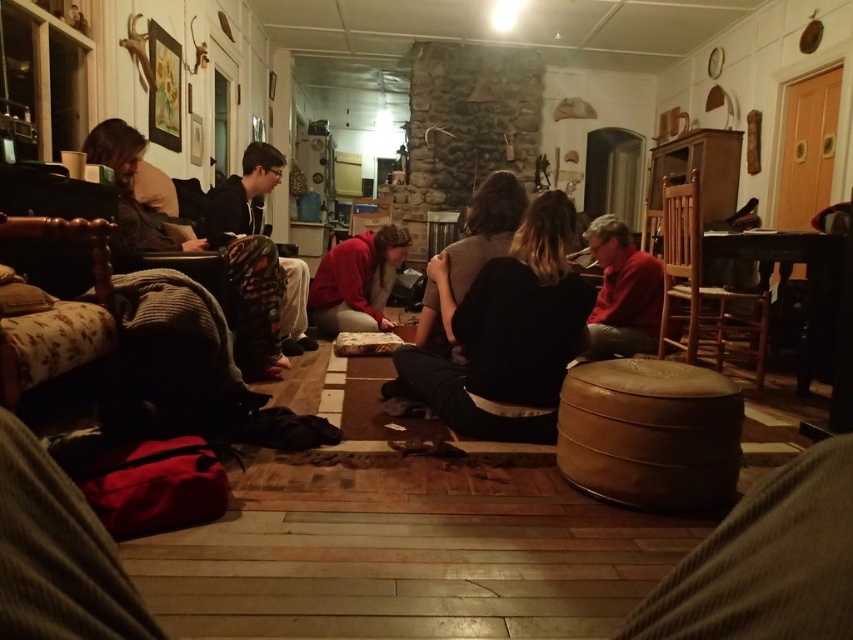
In the scene shown: Does leather ottoman at center appear over black hoodie at center?

Actually, leather ottoman at center is below black hoodie at center.

Between leather ottoman at center and black hoodie at center, which one is positioned lower?

leather ottoman at center

Locate an element on the screen. The width and height of the screenshot is (853, 640). leather ottoman at center is located at coordinates (650, 433).

Find the location of `leather ottoman at center`. leather ottoman at center is located at coordinates (650, 433).

Which of these two, leather ottoman at center or black fabric at center, stands shorter?

With less height is leather ottoman at center.

Between point (619, 420) and point (518, 198), which one is positioned behind?

Positioned behind is point (518, 198).

You are a GUI agent. You are given a task and a screenshot of the screen. Output one action in this format:
    pyautogui.click(x=<x>, y=<y>)
    Task: Click on the leather ottoman at center
    This screenshot has width=853, height=640.
    Given the screenshot: What is the action you would take?
    pyautogui.click(x=650, y=433)

Does leather ottoman at center lie behind camouflage pants at left?

That is False.

Does leather ottoman at center have a lesser width compared to camouflage pants at left?

Yes.

What do you see at coordinates (650, 433) in the screenshot? I see `leather ottoman at center` at bounding box center [650, 433].

Identify the location of leather ottoman at center. (650, 433).